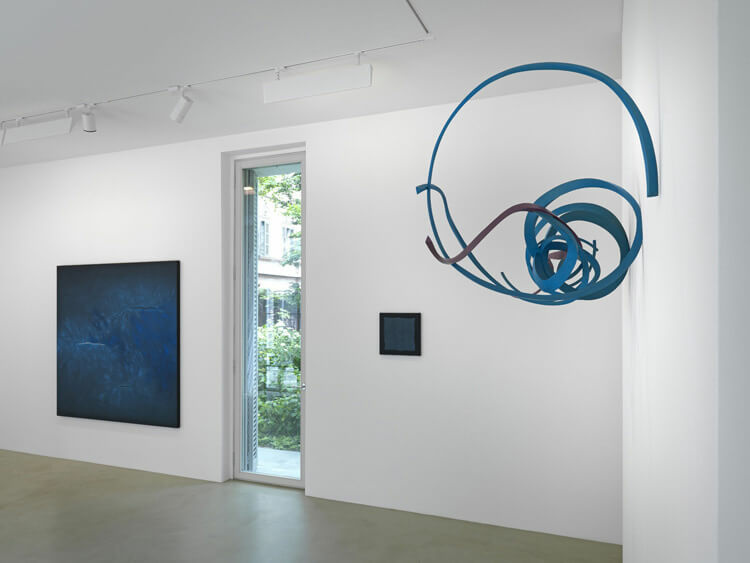
In order to click on frame in this screenshot , I will do `click(412, 330)`.